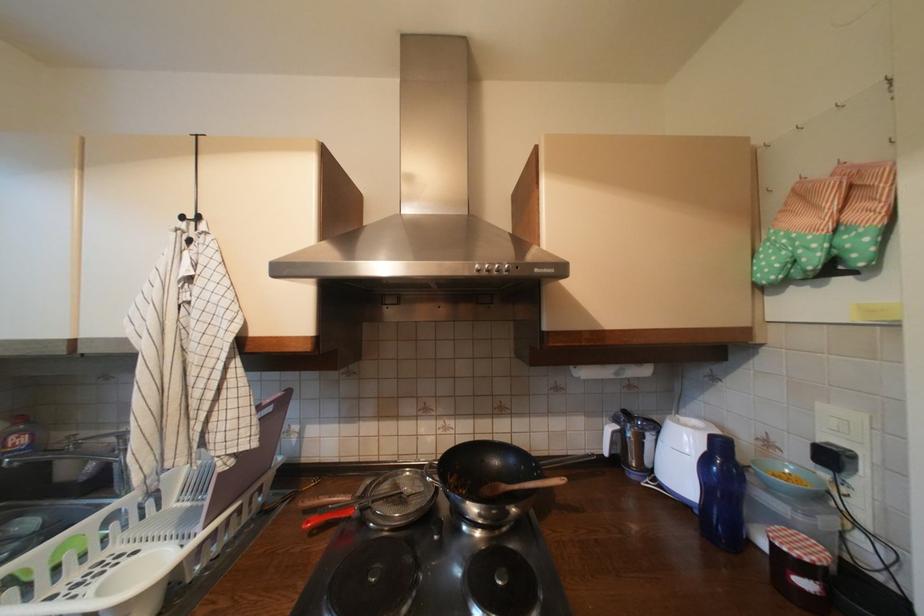
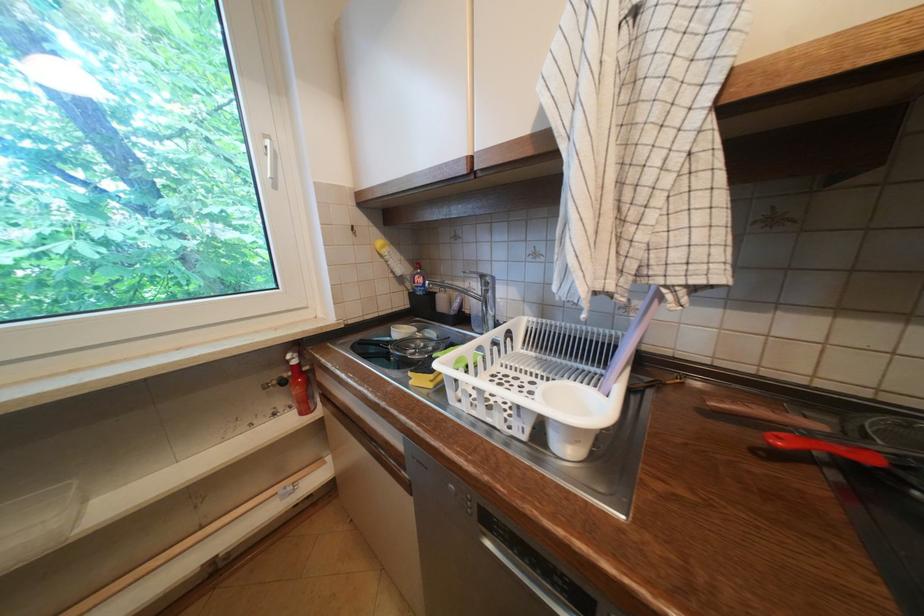
In the second image, find the point that corresponds to the point at 317,524 in the first image.

(788, 440)